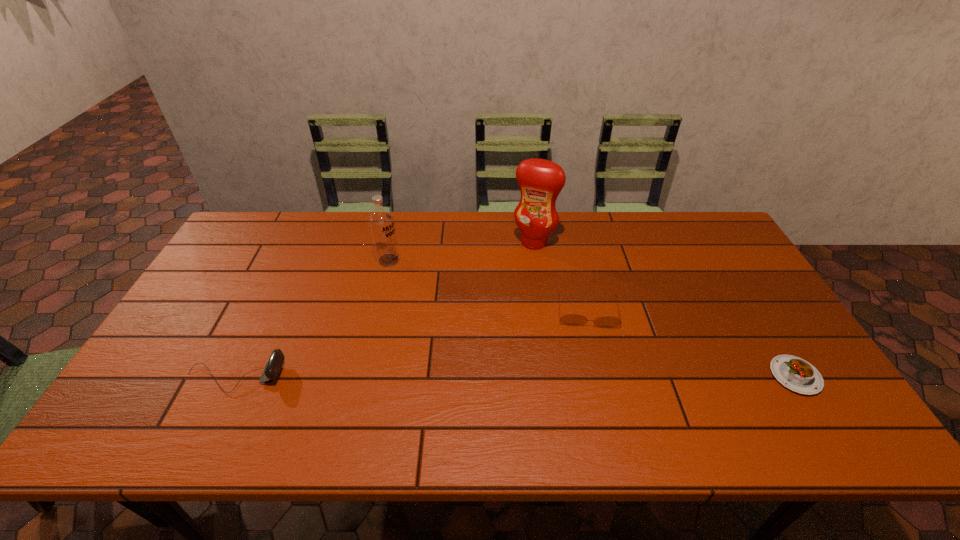
Where is `webcam`? webcam is located at coordinates (274, 364).

At what (x,y) coordinates should I click in order to perform the action: click on the rightmost object. Please return your answer as a coordinate pair (x, y). The height and width of the screenshot is (540, 960). Looking at the image, I should click on (798, 375).

Image resolution: width=960 pixels, height=540 pixels. I want to click on the farthest object, so click(540, 181).

The height and width of the screenshot is (540, 960). I want to click on condiment, so click(x=540, y=181).

The width and height of the screenshot is (960, 540). I want to click on the third nearest object, so click(569, 319).

I want to click on the fourth object from right to left, so click(x=381, y=221).

Where is `vodka`? vodka is located at coordinates (381, 221).

You are a GUI agent. You are given a task and a screenshot of the screen. Output one action in this format:
    pyautogui.click(x=<x>, y=<y>)
    Task: Click on the free space located on the front-facing side of the webcam
    Image resolution: width=960 pixels, height=540 pixels.
    Given the screenshot: What is the action you would take?
    pyautogui.click(x=319, y=377)

Find the location of a particular element. Image resolution: width=960 pixels, height=540 pixels. free space located 0.380m on the back of the rightmost object is located at coordinates click(x=724, y=260).

I want to click on vacant space located on the label side of the farthest object, so click(518, 266).